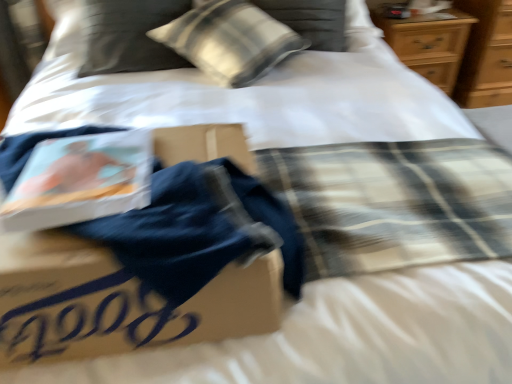
The image size is (512, 384). What do you see at coordinates (486, 55) in the screenshot?
I see `wooden dresser at upper right` at bounding box center [486, 55].

Find the location of a particular element. wooden dresser at upper right is located at coordinates point(486,55).

Locate an element on the screen. The image size is (512, 384). white textured pillow at upper center is located at coordinates (230, 41).

What is the approximate width of white textured pillow at upper center?

23.86 inches.

The width and height of the screenshot is (512, 384). Describe the element at coordinates (230, 41) in the screenshot. I see `white textured pillow at upper center` at that location.

At what (x,y) coordinates should I click in order to perform the action: click on wooden dresser at upper right. Please return your answer as a coordinate pair (x, y). Looking at the image, I should click on (486, 55).

Considering the positions of objects white textured pillow at upper center and wooden dresser at upper right in the image provided, who is more to the left, white textured pillow at upper center or wooden dresser at upper right?

white textured pillow at upper center.

Which is behind, white textured pillow at upper center or wooden dresser at upper right?

wooden dresser at upper right is further away from the camera.

Does point (247, 4) come in front of point (495, 8)?

Yes, it is.

From the image's perspective, which object appears higher, white textured pillow at upper center or wooden dresser at upper right?

wooden dresser at upper right.

From a real-world perspective, who is located lower, white textured pillow at upper center or wooden dresser at upper right?

In real-world perspective, wooden dresser at upper right is lower.

Which of these two, white textured pillow at upper center or wooden dresser at upper right, is wider?

white textured pillow at upper center.

Considering the relative sizes of white textured pillow at upper center and wooden dresser at upper right in the image provided, is white textured pillow at upper center taller than wooden dresser at upper right?

In fact, white textured pillow at upper center may be shorter than wooden dresser at upper right.

Considering the relative sizes of white textured pillow at upper center and wooden dresser at upper right in the image provided, is white textured pillow at upper center bigger than wooden dresser at upper right?

Incorrect, white textured pillow at upper center is not larger than wooden dresser at upper right.

Is white textured pillow at upper center not within wooden dresser at upper right?

Absolutely, white textured pillow at upper center is external to wooden dresser at upper right.

From the picture: Is white textured pillow at upper center beside wooden dresser at upper right?

No, white textured pillow at upper center is not next to wooden dresser at upper right.

Is white textured pillow at upper center facing away from wooden dresser at upper right?

No, white textured pillow at upper center is not facing the opposite direction of wooden dresser at upper right.

Can you tell me how much white textured pillow at upper center and wooden dresser at upper right differ in facing direction?

The facing directions of white textured pillow at upper center and wooden dresser at upper right are 36.6 degrees apart.

Measure the distance between white textured pillow at upper center and wooden dresser at upper right.

white textured pillow at upper center is 4.42 feet away from wooden dresser at upper right.

At what (x,y) coordinates should I click in order to perform the action: click on dresser located behind the white textured pillow at upper center. Please return your answer as a coordinate pair (x, y). The width and height of the screenshot is (512, 384). Looking at the image, I should click on (486, 55).

Based on their positions, is wooden dresser at upper right located to the left or right of white textured pillow at upper center?

Based on their positions, wooden dresser at upper right is located to the right of white textured pillow at upper center.

Between wooden dresser at upper right and white textured pillow at upper center, which one is positioned in front?

white textured pillow at upper center is in front.

Which point is more distant from viewer, (497,37) or (211,7)?

The point (497,37) is more distant.

Looking at this image, from the image's perspective, which is below, wooden dresser at upper right or white textured pillow at upper center?

From the image's view, white textured pillow at upper center is below.

From a real-world perspective, between wooden dresser at upper right and white textured pillow at upper center, who is vertically lower?

wooden dresser at upper right.

Looking at this image, considering the sizes of objects wooden dresser at upper right and white textured pillow at upper center in the image provided, who is thinner, wooden dresser at upper right or white textured pillow at upper center?

wooden dresser at upper right.

Considering the relative sizes of wooden dresser at upper right and white textured pillow at upper center in the image provided, is wooden dresser at upper right shorter than white textured pillow at upper center?

No.

Considering the sizes of objects wooden dresser at upper right and white textured pillow at upper center in the image provided, who is bigger, wooden dresser at upper right or white textured pillow at upper center?

Bigger between the two is wooden dresser at upper right.

Is white textured pillow at upper center surrounded by wooden dresser at upper right?

Actually, white textured pillow at upper center is outside wooden dresser at upper right.

Are wooden dresser at upper right and white textured pillow at upper center beside each other?

No, wooden dresser at upper right is not with white textured pillow at upper center.

Is wooden dresser at upper right aimed at white textured pillow at upper center?

No, wooden dresser at upper right is not facing towards white textured pillow at upper center.

Looking at this image, what's the angular difference between wooden dresser at upper right and white textured pillow at upper center's facing directions?

The angle between the facing direction of wooden dresser at upper right and the facing direction of white textured pillow at upper center is 36.6 degrees.

Find the location of a particular element. The image size is (512, 384). dresser below the white textured pillow at upper center (from a real-world perspective) is located at coordinates (486, 55).

Where is `dresser to the right of white textured pillow at upper center`? The height and width of the screenshot is (384, 512). dresser to the right of white textured pillow at upper center is located at coordinates (486, 55).

At what (x,y) coordinates should I click in order to perform the action: click on pillow in front of the wooden dresser at upper right. Please return your answer as a coordinate pair (x, y). Looking at the image, I should click on (230, 41).